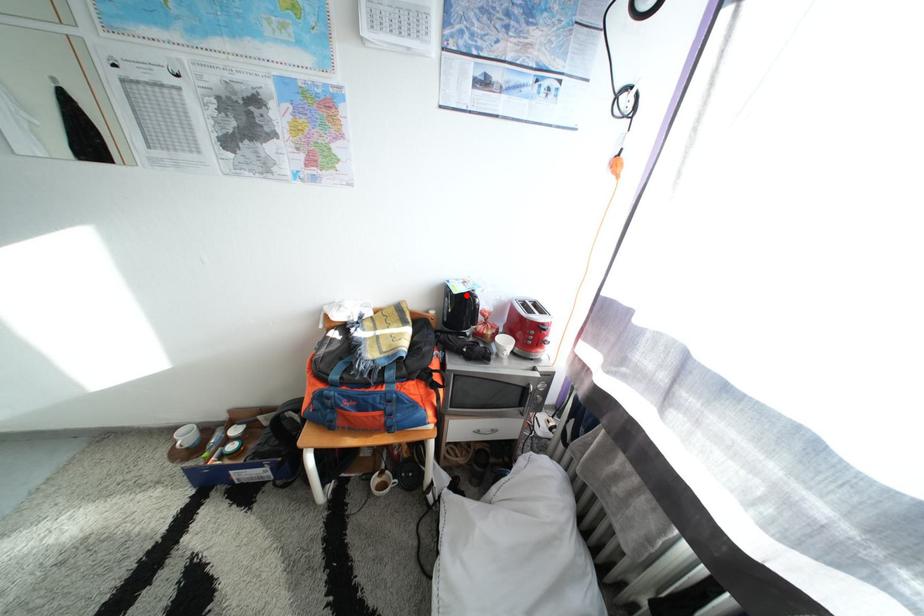
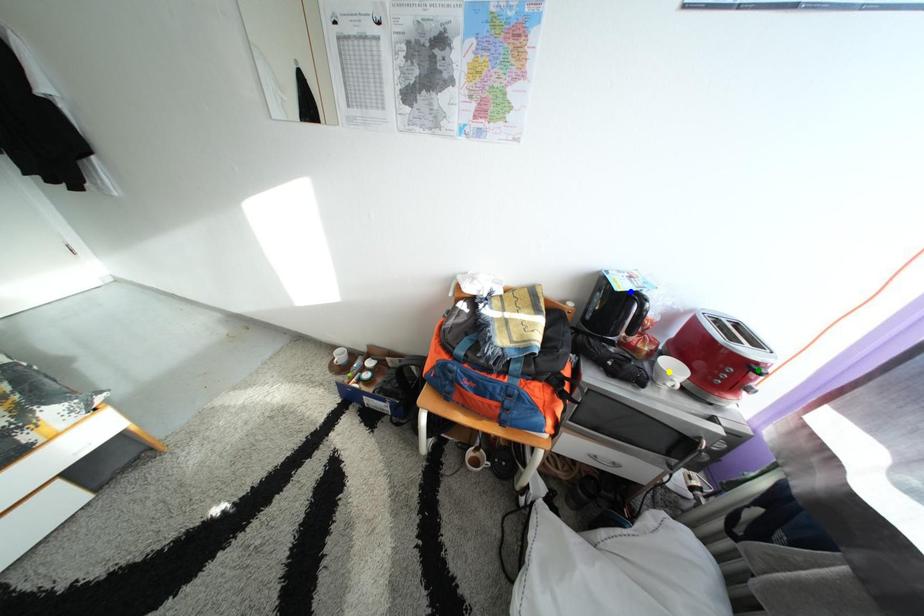
Question: I am providing you with two images of the same scene from different viewpoints. A red point is marked on the first image. You are given multiple points on the second image. Which point in image 2 is actually the same real-world point as the red point in image 1?

Choices:
 (A) yellow point
 (B) blue point
 (C) green point

Answer: (B)